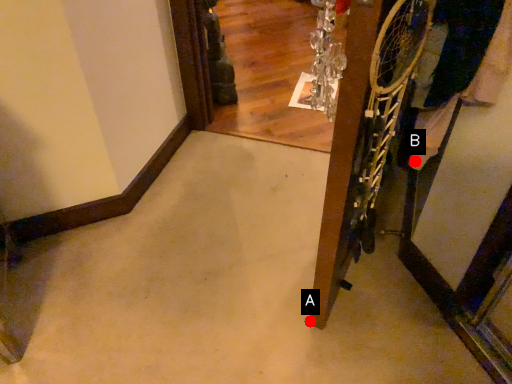
Question: Two points are circled on the image, labeled by A and B beside each circle. Which point appears farthest from the camera in this image?

Choices:
 (A) A is further
 (B) B is further

Answer: (A)